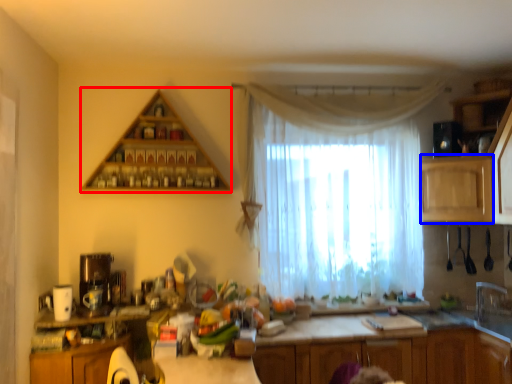
Question: Which object appears farthest to the camera in this image, shelf (highlighted by a red box) or cabinetry (highlighted by a blue box)?

Choices:
 (A) shelf
 (B) cabinetry

Answer: (B)